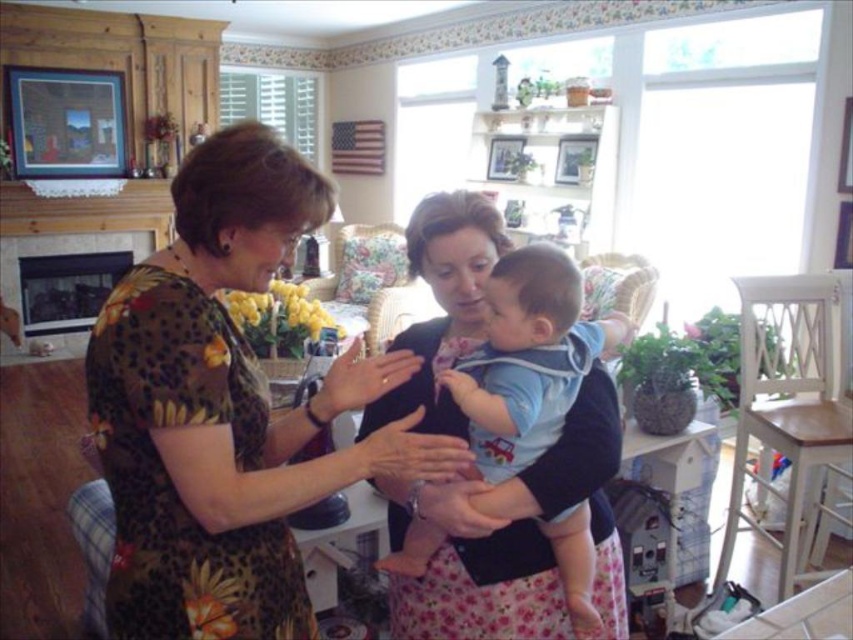
Question: Among these objects, which one is farthest from the camera?

Choices:
 (A) floral dress at center
 (B) light blue cotton shirt at center

Answer: (B)

Question: Considering the relative positions of floral dress at center and light blue cotton shirt at center in the image provided, where is floral dress at center located with respect to light blue cotton shirt at center?

Choices:
 (A) below
 (B) above

Answer: (B)

Question: Which object is farther from the camera taking this photo?

Choices:
 (A) light blue cotton shirt at center
 (B) floral dress at center

Answer: (A)

Question: Does floral dress at center have a smaller size compared to light blue cotton shirt at center?

Choices:
 (A) yes
 (B) no

Answer: (A)

Question: Can you confirm if floral dress at center is wider than light blue cotton shirt at center?

Choices:
 (A) no
 (B) yes

Answer: (B)